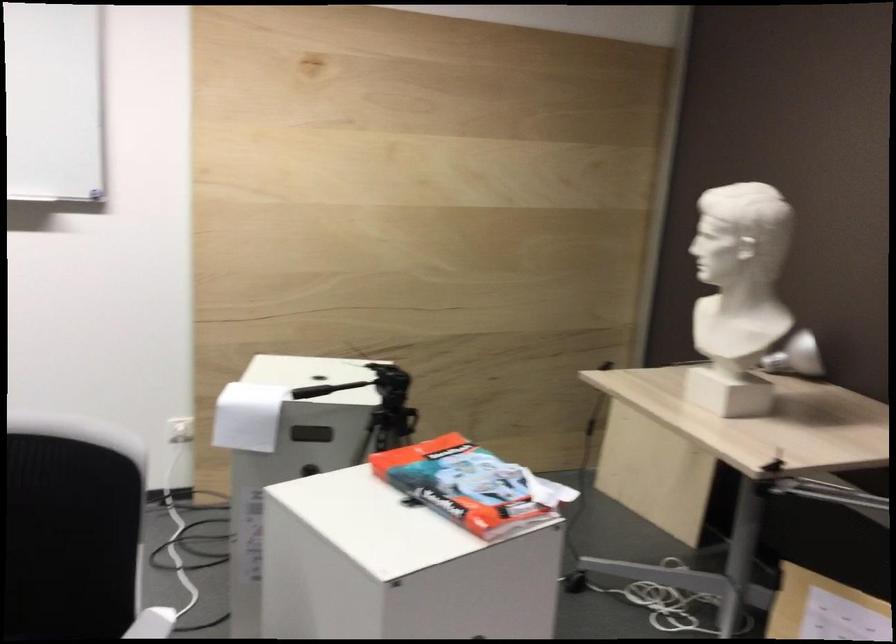
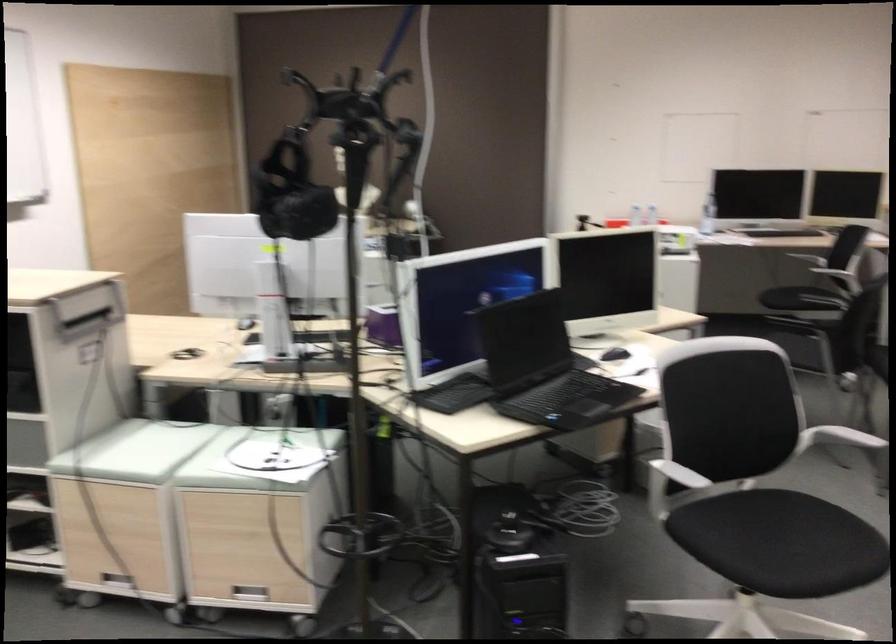
Question: I am providing you with two images of the same scene from different viewpoints. After the viewpoint changes to image2, which objects are now occluded?

Choices:
 (A) black computer mouse
 (B) black VR headset
 (C) white sheet of paper
 (D) black speaker box

Answer: (C)